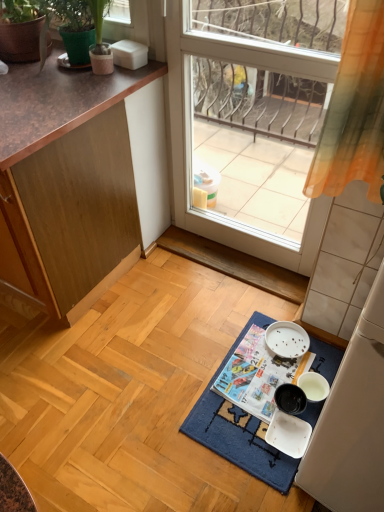
Image resolution: width=384 pixels, height=512 pixels. What are the coordinates of `transparent glass door at center` in the screenshot? It's located at (192, 142).

Measure the distance between point (41, 67) and camera.

Point (41, 67) and camera are 5.49 feet apart from each other.

Measure the distance between green matte flowerpot at upper left and camera.

green matte flowerpot at upper left and camera are 1.60 meters apart.

Describe the element at coordinates (239, 430) in the screenshot. I see `blue woven bath mat at center` at that location.

Find the location of `transparent glass door at center`. transparent glass door at center is located at coordinates (192, 142).

From a real-world perspective, is transparent glass door at center below printed paper magazine at center?

Actually, transparent glass door at center is physically above printed paper magazine at center in the real world.

Visually, is transparent glass door at center positioned to the left or to the right of printed paper magazine at center?

From the image, it's evident that transparent glass door at center is to the left of printed paper magazine at center.

Does transparent glass door at center have a greater width compared to printed paper magazine at center?

In fact, transparent glass door at center might be narrower than printed paper magazine at center.

Does transparent glass door at center come in front of printed paper magazine at center?

That is True.

Is wooden cabinet at left placed right next to green textured pot at upper left?

There is a gap between wooden cabinet at left and green textured pot at upper left.

Between wooden cabinet at left and green textured pot at upper left, which one has smaller size?

green textured pot at upper left.

Find the location of a particular element. This screenshot has width=384, height=512. cabinetry that is under the green textured pot at upper left (from a real-world perspective) is located at coordinates (67, 179).

From the image's perspective, who appears lower, green textured pot at upper left or printed paper magazine at center?

printed paper magazine at center, from the image's perspective.

What are the coordinates of `plant above the printed paper magazine at center (from a real-world perspective)` in the screenshot? It's located at (59, 16).

How different are the orientations of green textured pot at upper left and printed paper magazine at center in degrees?

1.5 degrees separate the facing orientations of green textured pot at upper left and printed paper magazine at center.

How much distance is there between green textured pot at upper left and printed paper magazine at center?

green textured pot at upper left and printed paper magazine at center are 1.38 meters apart.

Which is closer to the camera, (x=184, y=61) or (x=40, y=69)?

The point (x=40, y=69) is more forward.

Is transparent glass door at center surrounding green textured pot at upper left?

Definitely not — green textured pot at upper left is not inside transparent glass door at center.

In the scene shown: In terms of width, does transparent glass door at center look wider or thinner when compared to green textured pot at upper left?

Considering their sizes, transparent glass door at center looks slimmer than green textured pot at upper left.

Which object is positioned more to the right, transparent glass door at center or green textured pot at upper left?

Positioned to the right is transparent glass door at center.

Between white plastic bowl at lower right and green textured pot at upper left, which one appears on the left side from the viewer's perspective?

Positioned to the left is green textured pot at upper left.

Image resolution: width=384 pixels, height=512 pixels. I want to click on tableware directly beneath the green textured pot at upper left (from a real-world perspective), so click(288, 434).

Is white plastic bowl at lower right in front of or behind green textured pot at upper left in the image?

Visually, white plastic bowl at lower right is located behind green textured pot at upper left.

Between green textured pot at upper left and transparent glass door at center, which one appears on the right side from the viewer's perspective?

transparent glass door at center.

Where is `window that appears below the green textured pot at upper left (from the image's perspective)`? window that appears below the green textured pot at upper left (from the image's perspective) is located at coordinates (192, 142).

Do you think green textured pot at upper left is within transparent glass door at center, or outside of it?

The correct answer is: outside.

How many degrees apart are the facing directions of green textured pot at upper left and transparent glass door at center?

0.0484 degrees separate the facing orientations of green textured pot at upper left and transparent glass door at center.

Is point (43, 55) positioned before point (298, 455)?

No, it is not.

Find the location of `tableware lying behind the green textured pot at upper left`. tableware lying behind the green textured pot at upper left is located at coordinates (288, 434).

Is green textured pot at upper left positioned beyond the bounds of white plastic bowl at lower right?

That's correct, green textured pot at upper left is outside of white plastic bowl at lower right.

Where is `magazine that appears below the transparent glass door at center (from the image's perspective)`? This screenshot has height=512, width=384. magazine that appears below the transparent glass door at center (from the image's perspective) is located at coordinates pyautogui.click(x=258, y=375).

Find the location of a particular element. plant above the wooden cabinet at left (from the image's perspective) is located at coordinates (59, 16).

Based on their spatial positions, is printed paper magazine at center or transparent glass door at center further from wooden cabinet at left?

The object further to wooden cabinet at left is printed paper magazine at center.

Looking at this image, based on their spatial positions, is transparent glass door at center or white plastic bowl at lower right further from blue woven bath mat at center?

transparent glass door at center.

Which object lies nearer to the anchor point green matte flowerpot at upper left, green textured pot at upper left or white plastic bowl at lower right?

green textured pot at upper left is closer to green matte flowerpot at upper left.

Looking at the image, which one is located further to printed paper magazine at center, white plastic bowl at lower right or green matte flowerpot at upper left?

green matte flowerpot at upper left is further to printed paper magazine at center.

When comparing their distances from blue woven bath mat at center, does printed paper magazine at center or wooden cabinet at left seem further?

wooden cabinet at left is further to blue woven bath mat at center.

From the image, which object appears to be farther from blue woven bath mat at center, green textured pot at upper left or green matte flowerpot at upper left?

green matte flowerpot at upper left lies further to blue woven bath mat at center than the other object.

Based on their spatial positions, is white plastic bowl at lower right or blue woven bath mat at center closer to green textured pot at upper left?

The object closer to green textured pot at upper left is blue woven bath mat at center.

Which object lies nearer to the anchor point white plastic bowl at lower right, green matte flowerpot at upper left or printed paper magazine at center?

The object closer to white plastic bowl at lower right is printed paper magazine at center.

You are a GUI agent. You are given a task and a screenshot of the screen. Output one action in this format:
    pyautogui.click(x=<x>, y=<y>)
    Task: Click on the cabinetry that lies between green textured pot at upper left and white plastic bowl at lower right from top to bottom
    This screenshot has height=512, width=384.
    Given the screenshot: What is the action you would take?
    pyautogui.click(x=67, y=179)

At what (x,y) coordinates should I click in order to perform the action: click on bath mat between wooden cabinet at left and white plastic bowl at lower right in the horizontal direction. Please return your answer as a coordinate pair (x, y). Looking at the image, I should click on (239, 430).

Find the location of `magazine between green matte flowerpot at upper left and white plastic bowl at lower right in the vertical direction`. magazine between green matte flowerpot at upper left and white plastic bowl at lower right in the vertical direction is located at coordinates (258, 375).

Where is `magazine between green matte flowerpot at upper left and blue woven bath mat at center in the up-down direction`? magazine between green matte flowerpot at upper left and blue woven bath mat at center in the up-down direction is located at coordinates (258, 375).